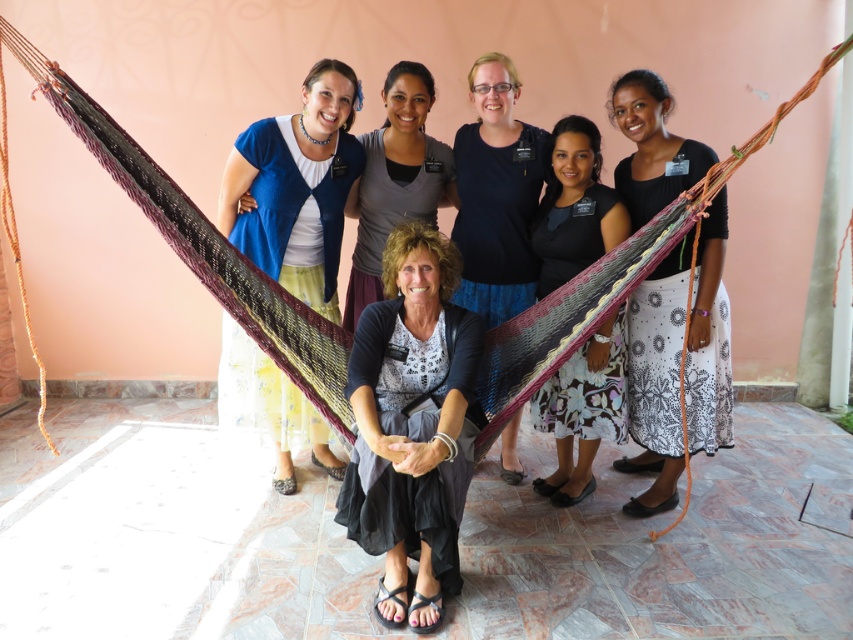
The height and width of the screenshot is (640, 853). Describe the element at coordinates (412, 422) in the screenshot. I see `dark gray linen skirt at center` at that location.

Can you confirm if dark gray linen skirt at center is taller than floral skirt at center?

Correct, dark gray linen skirt at center is much taller as floral skirt at center.

Who is more distant from viewer, (367, 497) or (577, 476)?

Positioned behind is point (577, 476).

You are a GUI agent. You are given a task and a screenshot of the screen. Output one action in this format:
    pyautogui.click(x=<x>, y=<y>)
    Task: Click on the dark gray linen skirt at center
    The height and width of the screenshot is (640, 853).
    Given the screenshot: What is the action you would take?
    pyautogui.click(x=412, y=422)

Between dark gray linen skirt at center and matte blue cardigan at upper left, which one has more height?

Standing taller between the two is dark gray linen skirt at center.

Is dark gray linen skirt at center further to camera compared to matte blue cardigan at upper left?

No, it is in front of matte blue cardigan at upper left.

The image size is (853, 640). Identify the location of dark gray linen skirt at center. (412, 422).

Locate an element on the screen. multicolored woven hammock at center is located at coordinates (198, 241).